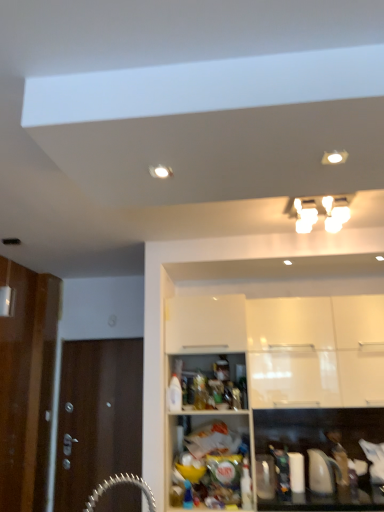
Question: Is white glossy light fixture at upper center wider than white glossy cabinet at upper center, the 1th cabinetry viewed from the front?

Choices:
 (A) yes
 (B) no

Answer: (A)

Question: Can you confirm if white glossy light fixture at upper center is bigger than white glossy cabinet at upper center, the second cabinetry viewed from the back?

Choices:
 (A) no
 (B) yes

Answer: (A)

Question: Is the position of white glossy light fixture at upper center less distant than that of white glossy cabinet at upper center, the 1th cabinetry viewed from the front?

Choices:
 (A) yes
 (B) no

Answer: (A)

Question: Considering the relative positions of white glossy light fixture at upper center and white glossy cabinet at upper center, the second cabinetry viewed from the back, in the image provided, is white glossy light fixture at upper center to the left of white glossy cabinet at upper center, the second cabinetry viewed from the back, from the viewer's perspective?

Choices:
 (A) yes
 (B) no

Answer: (B)

Question: Considering the relative sizes of white glossy light fixture at upper center and white glossy cabinet at upper center, the 1th cabinetry viewed from the front, in the image provided, is white glossy light fixture at upper center thinner than white glossy cabinet at upper center, the 1th cabinetry viewed from the front,?

Choices:
 (A) no
 (B) yes

Answer: (A)

Question: Is white glossy light fixture at upper center aimed at white glossy cabinet at upper center, the second cabinetry viewed from the back?

Choices:
 (A) yes
 (B) no

Answer: (B)

Question: Is white glossy cabinet at upper right, arranged as the 2th cabinetry when viewed from the front, closer to camera compared to brown wooden door at left?

Choices:
 (A) yes
 (B) no

Answer: (A)

Question: Can you confirm if white glossy cabinet at upper right, arranged as the 2th cabinetry when viewed from the front, is taller than brown wooden door at left?

Choices:
 (A) no
 (B) yes

Answer: (A)

Question: From a real-world perspective, is white glossy cabinet at upper right, arranged as the 2th cabinetry when viewed from the front, located higher than brown wooden door at left?

Choices:
 (A) yes
 (B) no

Answer: (A)

Question: Is white glossy cabinet at upper right, which is the first cabinetry from back to front, looking in the opposite direction of brown wooden door at left?

Choices:
 (A) yes
 (B) no

Answer: (B)

Question: Is the depth of white glossy cabinet at upper right, which is the first cabinetry from back to front, greater than that of brown wooden door at left?

Choices:
 (A) no
 (B) yes

Answer: (A)

Question: From the image's perspective, is white glossy cabinet at upper right, which is the first cabinetry from back to front, on brown wooden door at left?

Choices:
 (A) yes
 (B) no

Answer: (A)

Question: Is white glossy light fixture at upper center positioned with its back to white glossy cabinet at upper right, arranged as the 2th cabinetry when viewed from the front?

Choices:
 (A) no
 (B) yes

Answer: (A)